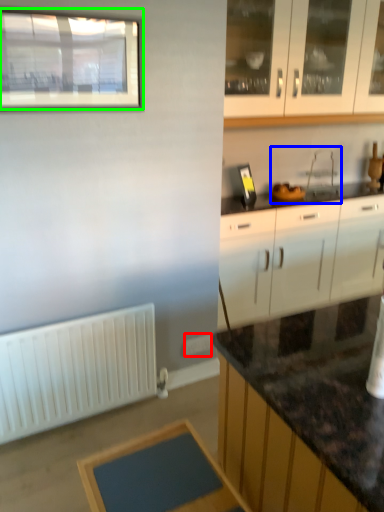
Question: Based on their relative distances, which object is farther from electric outlet (highlighted by a red box)? Choose from sink (highlighted by a blue box) and window (highlighted by a green box).

Choices:
 (A) sink
 (B) window

Answer: (B)